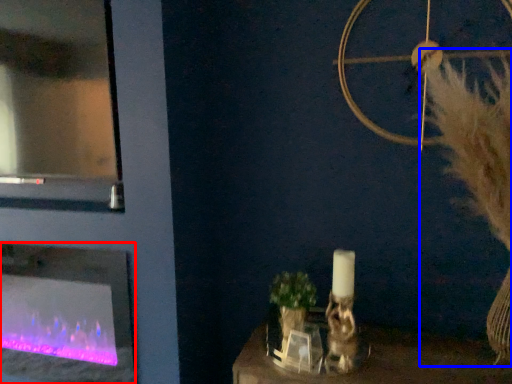
Question: Which point is further to the camera, fireplace (highlighted by a red box) or fur (highlighted by a blue box)?

Choices:
 (A) fireplace
 (B) fur

Answer: (A)